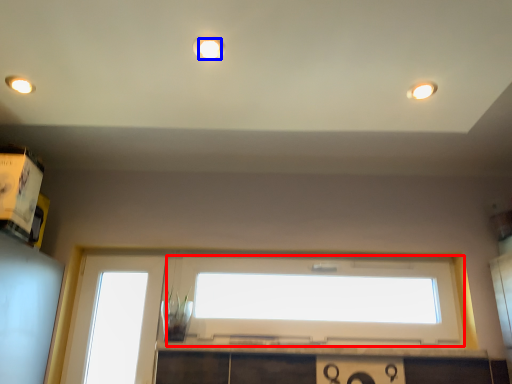
Question: Which object is closer to the camera taking this photo, window (highlighted by a red box) or lighting (highlighted by a blue box)?

Choices:
 (A) window
 (B) lighting

Answer: (B)